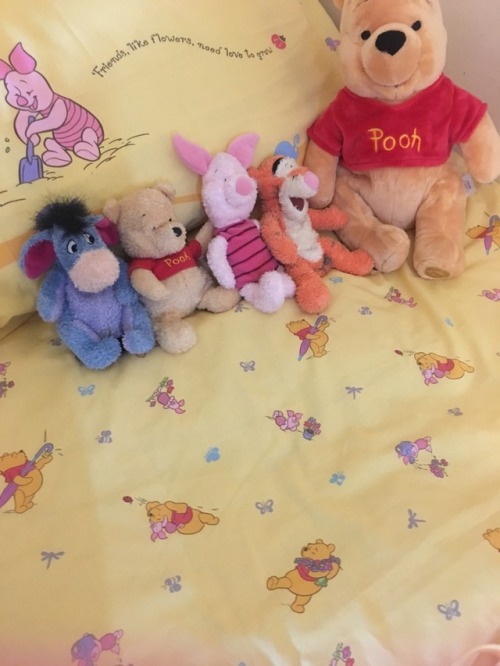
I want to click on stuffed animals from the winnie the pooh stories, so click(409, 147), click(295, 220), click(227, 238), click(169, 268), click(103, 288).